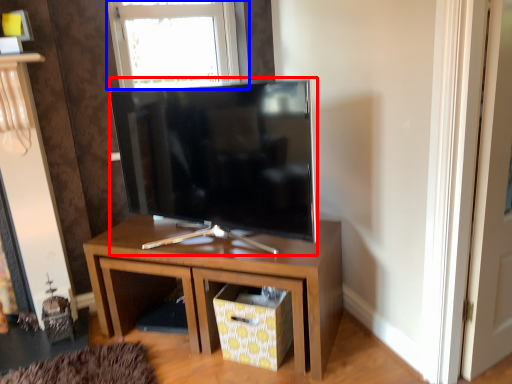
Question: Which object appears closest to the camera in this image, television (highlighted by a red box) or window (highlighted by a blue box)?

Choices:
 (A) television
 (B) window

Answer: (A)